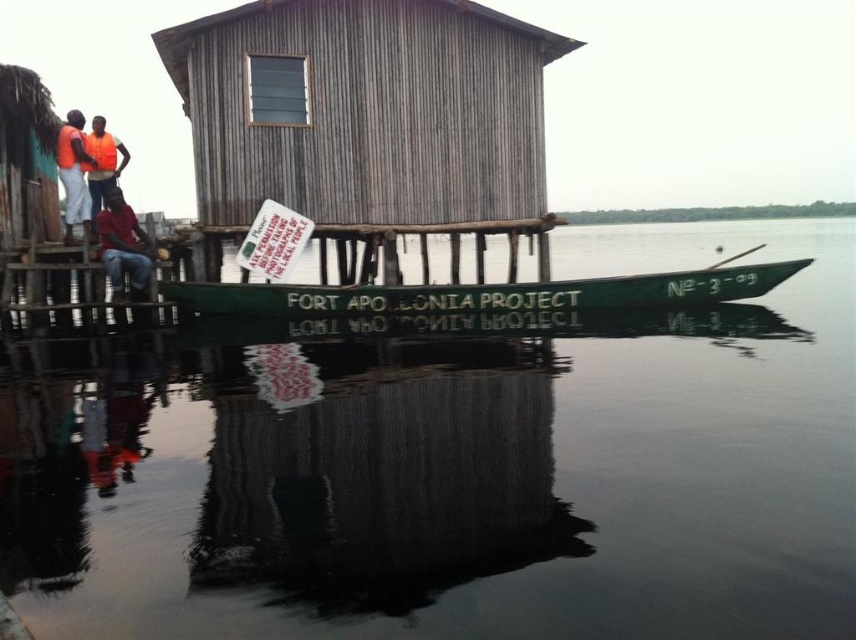
Can you confirm if green matte canoe at center is shorter than orange life vest at left?

Correct, green matte canoe at center is not as tall as orange life vest at left.

Who is more distant from viewer, (651, 296) or (80, 224)?

The point (80, 224) is more distant.

I want to click on green matte canoe at center, so click(x=485, y=292).

Between green smooth water at lower center and wooden hut at center, which one is positioned lower?

green smooth water at lower center

Does green smooth water at lower center have a greater width compared to wooden hut at center?

Yes, green smooth water at lower center is wider than wooden hut at center.

Identify the location of green smooth water at lower center. (456, 472).

Where is `green smooth water at lower center`? green smooth water at lower center is located at coordinates (456, 472).

Between matte red shirt at center and white paper sign at center, which one appears on the left side from the viewer's perspective?

matte red shirt at center is more to the left.

Between point (117, 196) and point (280, 204), which one is positioned in front?

Point (117, 196) is in front.

In order to click on matte red shirt at center in this screenshot , I will do `click(123, 248)`.